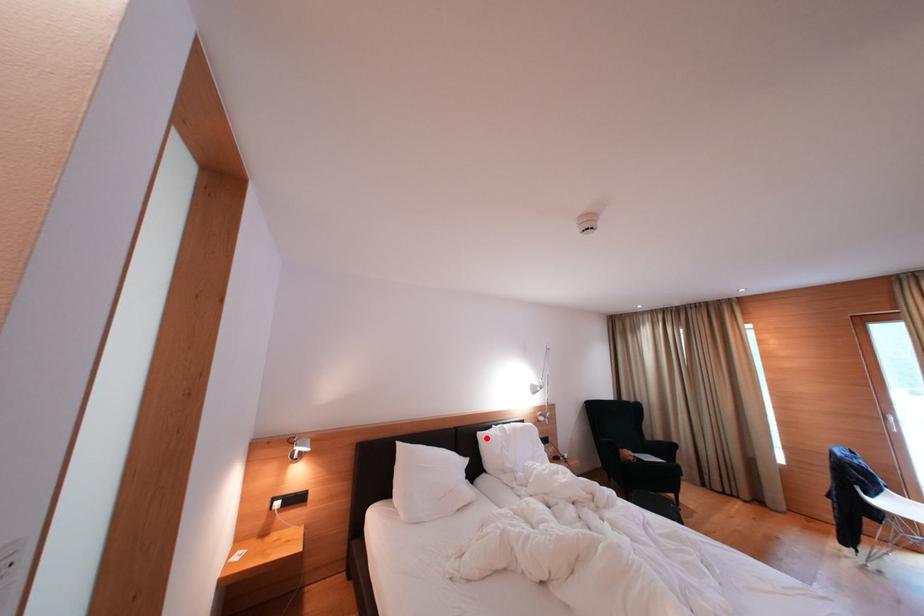
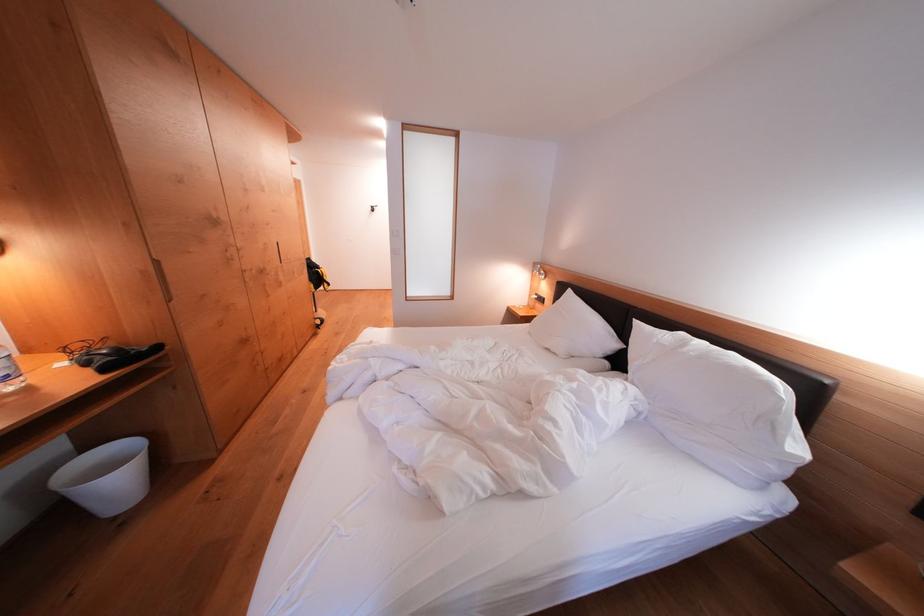
Question: I am providing you with two images of the same scene from different viewpoints. A red point is shown in image1. For the corresponding object point in image2, is it positioned nearer or farther from the camera?

Choices:
 (A) Nearer
 (B) Farther

Answer: (A)